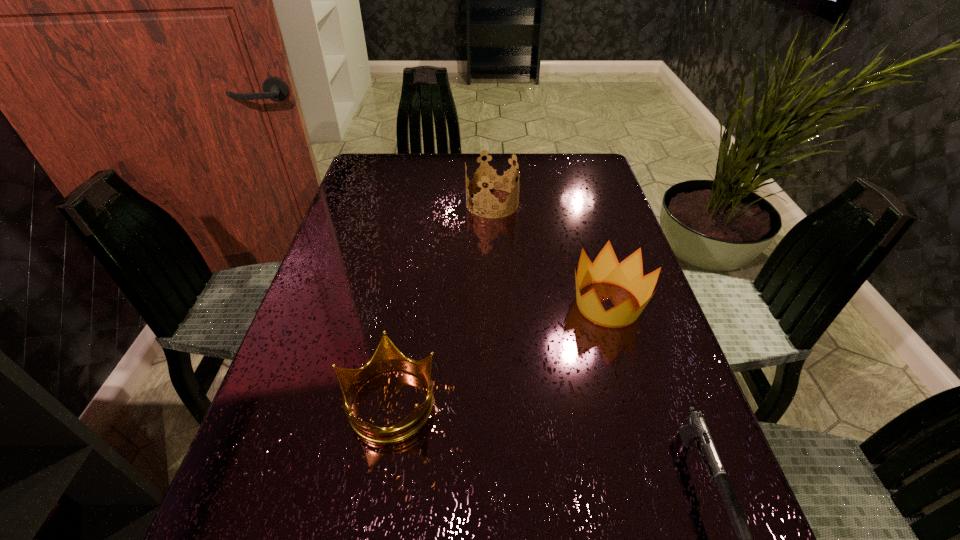
Identify the location of object that is at the left edge. (387, 357).

The width and height of the screenshot is (960, 540). What are the coordinates of `object positioned at the right edge` in the screenshot? It's located at pos(628,274).

The height and width of the screenshot is (540, 960). In the image, there is a desktop. Identify the location of vacant space at the far edge. (527, 156).

The image size is (960, 540). In the image, there is a desktop. Find the location of `vacant area at the left edge`. vacant area at the left edge is located at coordinates (296, 328).

Identify the location of vacant area at the right edge. Image resolution: width=960 pixels, height=540 pixels. (614, 435).

Find the location of a particular element. This screenshot has width=960, height=540. blank space at the far left corner of the desktop is located at coordinates (372, 157).

This screenshot has width=960, height=540. Identify the location of vacant area at the far right corner of the desktop. (549, 155).

Locate an element on the screen. This screenshot has width=960, height=540. vacant space in between the second farthest crown and the leftmost crown is located at coordinates (498, 353).

The height and width of the screenshot is (540, 960). In order to click on object that ranks as the closest to the leftmost object in this screenshot , I will do `click(628, 274)`.

Identify which object is the second nearest to the nearest crown. Please provide its 2D coordinates. Your answer should be formatted as a tuple, i.e. [(x, y)], where the tuple contains the x and y coordinates of a point satisfying the conditions above.

[(697, 430)]